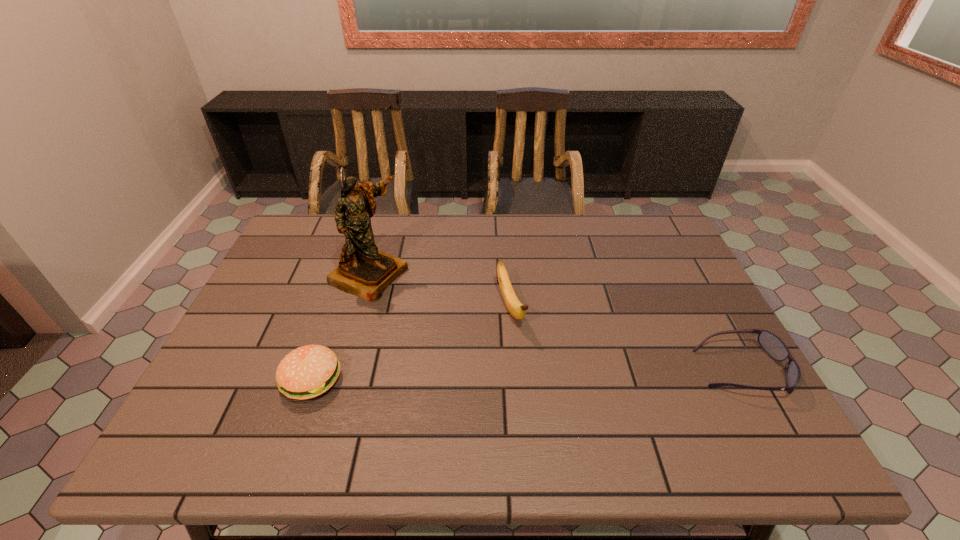
At what (x,y) coordinates should I click in order to perform the action: click on patty. Please return your answer as a coordinate pair (x, y). The width and height of the screenshot is (960, 540). Looking at the image, I should click on (308, 371).

Find the location of a particular element. The width and height of the screenshot is (960, 540). sunglasses is located at coordinates (771, 344).

What are the coordinates of `the third shortest object` in the screenshot? It's located at (515, 307).

What are the coordinates of `banana` in the screenshot? It's located at (515, 307).

You are a GUI agent. You are given a task and a screenshot of the screen. Output one action in this format:
    pyautogui.click(x=<x>, y=<y>)
    Task: Click on the figurine
    The width and height of the screenshot is (960, 540).
    Given the screenshot: What is the action you would take?
    pyautogui.click(x=364, y=271)

Find the location of a particular element. vacant area situated 0.240m on the right of the patty is located at coordinates (445, 379).

Find the location of a particular element. The height and width of the screenshot is (540, 960). vacant point located 0.090m at the stem of the third object from left to right is located at coordinates (528, 362).

This screenshot has height=540, width=960. Identify the location of vacant space located at the stem of the third object from left to right. (540, 389).

This screenshot has width=960, height=540. I want to click on vacant space located 0.120m at the stem of the third object from left to right, so click(533, 372).

What are the coordinates of `vacant space situated 0.260m on the front-facing side of the figurine` in the screenshot? It's located at (477, 323).